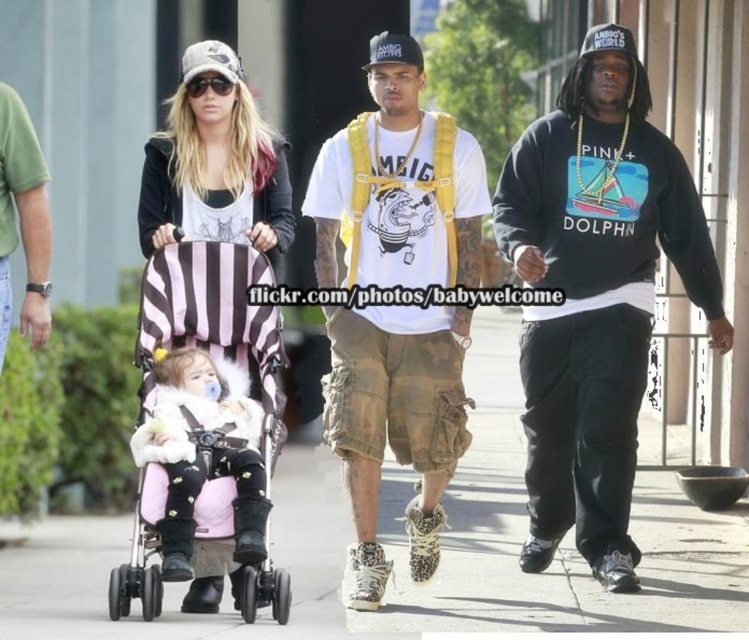
Between black cotton sweatshirt at right and fuzzy white coat at center, which one is positioned higher?

black cotton sweatshirt at right is higher up.

Can you confirm if black cotton sweatshirt at right is bigger than fuzzy white coat at center?

Indeed, black cotton sweatshirt at right has a larger size compared to fuzzy white coat at center.

Which is in front, point (634, 220) or point (210, 376)?

Positioned in front is point (210, 376).

The width and height of the screenshot is (749, 640). Find the location of `black cotton sweatshirt at right`. black cotton sweatshirt at right is located at coordinates (595, 294).

Which is below, matte black jacket at center or fuzzy white coat at center?

Positioned lower is fuzzy white coat at center.

Between point (184, 76) and point (252, 468), which one is positioned in front?

Positioned in front is point (252, 468).

This screenshot has height=640, width=749. Identify the location of matte black jacket at center. (215, 163).

Between point (428, 360) and point (261, 522), which one is positioned in front?

Point (261, 522) is in front.

At what (x,y) coordinates should I click in order to perform the action: click on white cotton t-shirt at center. Please return your answer as a coordinate pair (x, y). The height and width of the screenshot is (640, 749). Looking at the image, I should click on (398, 186).